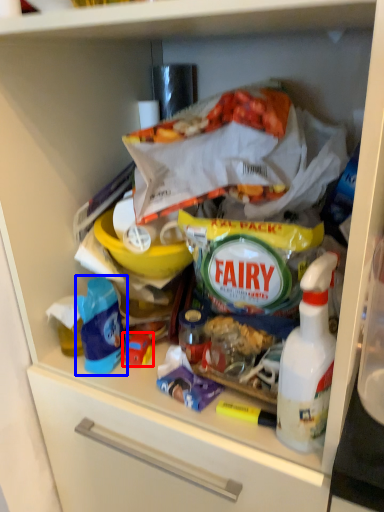
Question: Which object appears farthest to the camera in this image, toy (highlighted by a red box) or product (highlighted by a blue box)?

Choices:
 (A) toy
 (B) product

Answer: (A)